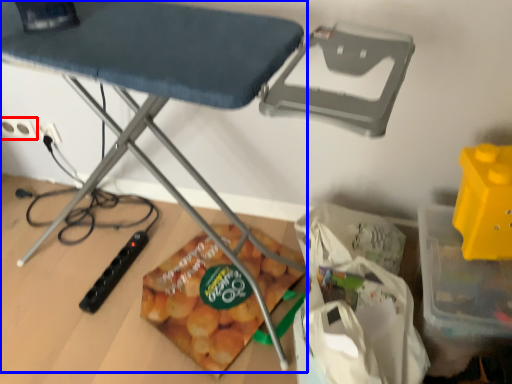
Question: Which of the following is the closest to the observer, electric outlet (highlighted by a red box) or table (highlighted by a blue box)?

Choices:
 (A) electric outlet
 (B) table

Answer: (B)